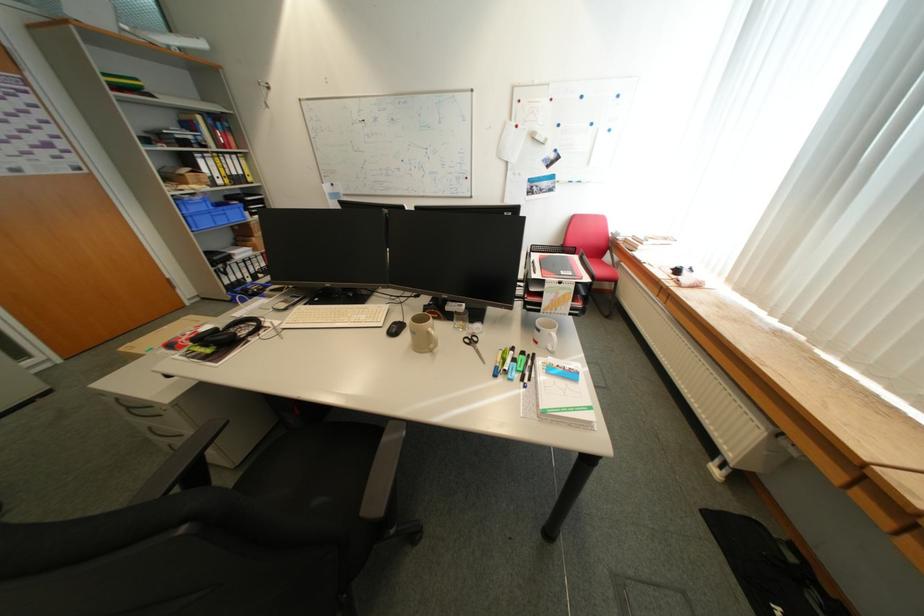
Where is `blue plastic bin`? The width and height of the screenshot is (924, 616). blue plastic bin is located at coordinates (209, 213).